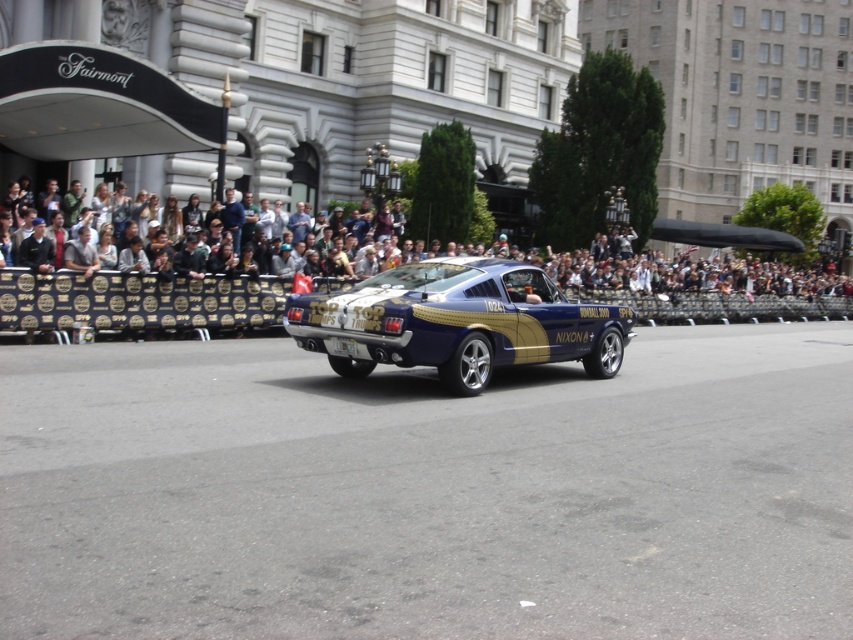
What is located at the point with coordinates (428, 492) in the image?

The smooth asphalt road at center is located at point (428, 492).

You are a photographer trying to capture the shiny metallic car at center from above. The smooth asphalt road at center is in your way. Can you still take the photo without moving the road?

The smooth asphalt road at center is shorter than the shiny metallic car at center, so the road does not fully cover the car. You can still take the photo from above as the car extends beyond the road in some areas.

Looking at this image, you are a driver in a parade and you want to make sure you stay on the smooth asphalt road at center while avoiding the dark gray crowd at upper center. Which one should you focus on keeping in your rearview mirror as you drive forward?

The dark gray crowd at upper center is larger in size compared to the smooth asphalt road at center, so you should focus on keeping the dark gray crowd at upper center in your rearview mirror to avoid it while driving forward.